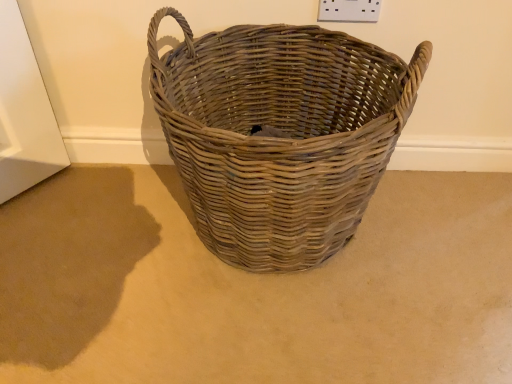
Find the location of `vacant area that is situated to the right of natural woven basket at center`. vacant area that is situated to the right of natural woven basket at center is located at coordinates (444, 246).